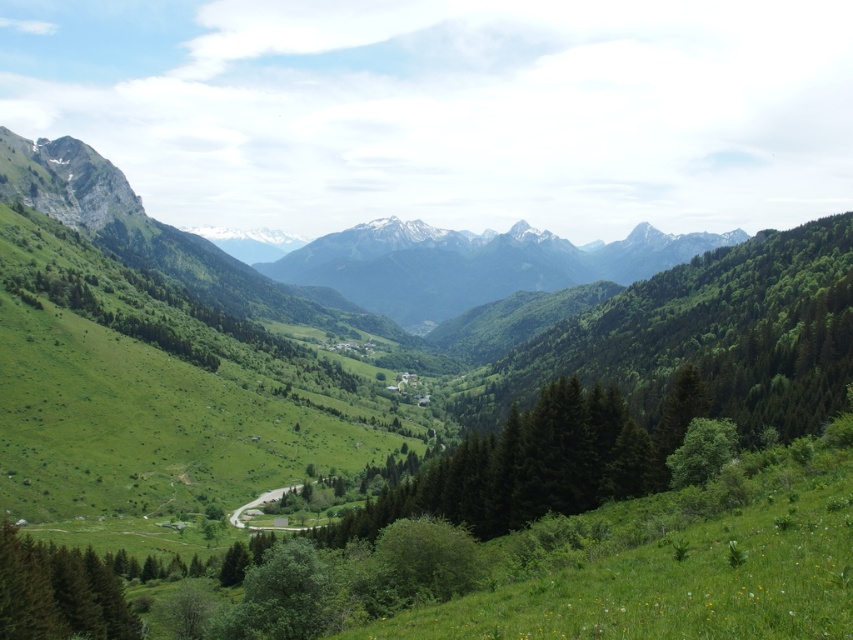
Is green grassy mountain range at center smaller than green forested mountain range at center?

No.

Does point (48, 157) lie behind point (344, 264)?

No.

The image size is (853, 640). I want to click on green grassy mountain range at center, so click(148, 230).

Where is `green grassy mountain range at center`? This screenshot has width=853, height=640. green grassy mountain range at center is located at coordinates (148, 230).

Which is more to the right, green forested mountain range at center or green matte tree at lower left?

Positioned to the right is green forested mountain range at center.

Can you confirm if green forested mountain range at center is shorter than green matte tree at lower left?

No.

Image resolution: width=853 pixels, height=640 pixels. What are the coordinates of `green forested mountain range at center` in the screenshot? It's located at (471, 264).

Is point (4, 179) in front of point (44, 557)?

No, it is behind (44, 557).

Between green grassy mountain range at center and green matte tree at lower left, which one is positioned lower?

green matte tree at lower left is lower down.

This screenshot has width=853, height=640. In order to click on green grassy mountain range at center in this screenshot , I will do `click(148, 230)`.